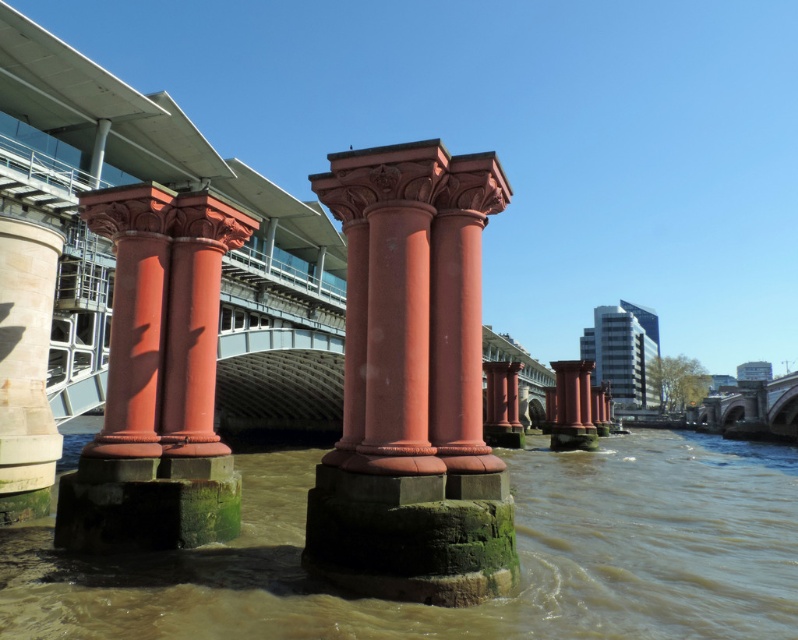
You are standing at the point with coordinates point (482, 604) and want to walk towards the nearest red column. Which direction should you face to move directly towards it?

The point (482, 604) is located at the green mossy concrete at lower center. To move directly towards the nearest red column, you should face north.

You are a photographer positioned at the edge of the river, aiming to capture both the matte red column at center and the white stone column at left in your shot. Based on their positions, which column will appear larger in your photo?

The matte red column at center appears larger in the photo because it is closer to the viewer than the white stone column at left.